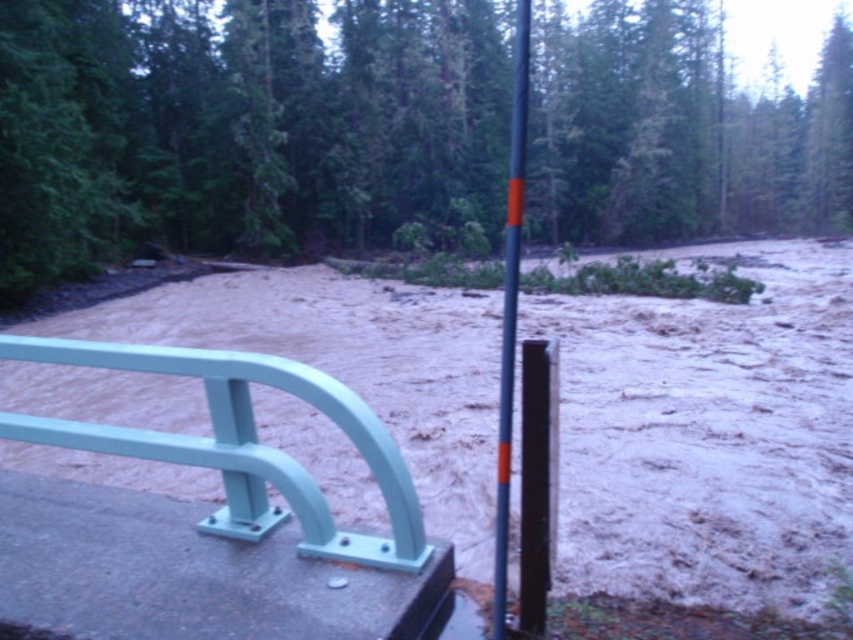
Does point (473, 529) lie in front of point (526, 86)?

Yes, it is in front of point (526, 86).

Is point (822, 404) less distant than point (503, 266)?

Yes, it is.

Locate an element on the screen. This screenshot has width=853, height=640. brown sandy mud at center is located at coordinates (706, 435).

Between green matte tree at upper center and orange-painted metal pole at center, which one appears on the left side from the viewer's perspective?

orange-painted metal pole at center

How far apart are green matte tree at upper center and orange-painted metal pole at center?

The distance of green matte tree at upper center from orange-painted metal pole at center is 44.71 feet.

Locate an element on the screen. green matte tree at upper center is located at coordinates (247, 131).

Does green matte tree at upper center appear under brown sandy mud at center?

No, green matte tree at upper center is not below brown sandy mud at center.

Does green matte tree at upper center lie behind brown sandy mud at center?

Yes, it is.

Between point (648, 160) and point (167, 385), which one is positioned in front?

Point (167, 385)

The image size is (853, 640). Identify the location of green matte tree at upper center. (247, 131).